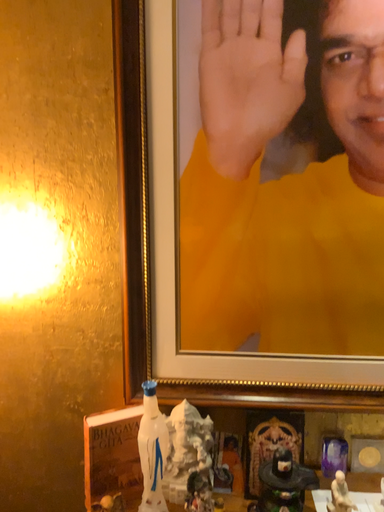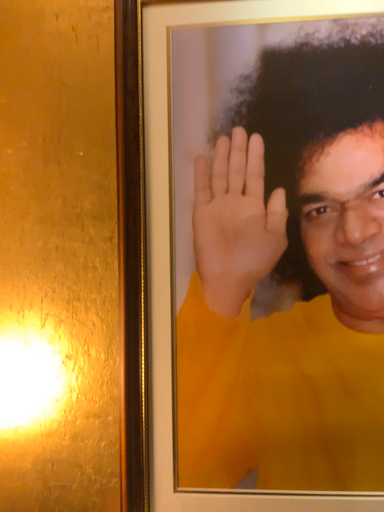
Question: Which way did the camera rotate in the video?

Choices:
 (A) rotated upward
 (B) rotated downward

Answer: (A)